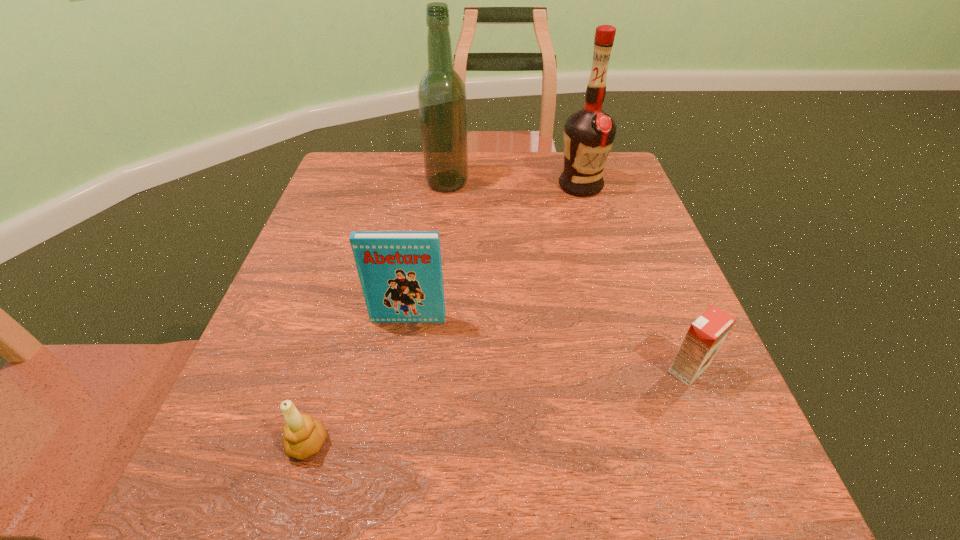
What are the coordinates of `free region located 0.330m on the back of the orange juice` in the screenshot? It's located at [634, 233].

Locate an element on the screen. The height and width of the screenshot is (540, 960). vacant space positioned 0.060m on the front of the candle_holder is located at coordinates (288, 511).

Locate an element on the screen. The height and width of the screenshot is (540, 960). object that is at the near edge is located at coordinates (304, 436).

This screenshot has width=960, height=540. I want to click on object present at the left edge, so (x=304, y=436).

What are the coordinates of `liquor present at the right edge` in the screenshot? It's located at (589, 133).

At what (x,y) coordinates should I click in order to perform the action: click on orange juice that is at the right edge. Please return your answer as a coordinate pair (x, y). The image size is (960, 540). Looking at the image, I should click on (706, 334).

The height and width of the screenshot is (540, 960). What are the coordinates of `object that is at the near left corner` in the screenshot? It's located at (304, 436).

Locate an element on the screen. This screenshot has width=960, height=540. object located in the far right corner section of the desktop is located at coordinates (589, 133).

Find the location of `vacant area at the far edge`. vacant area at the far edge is located at coordinates (558, 171).

This screenshot has height=540, width=960. I want to click on free space at the left edge, so click(x=289, y=346).